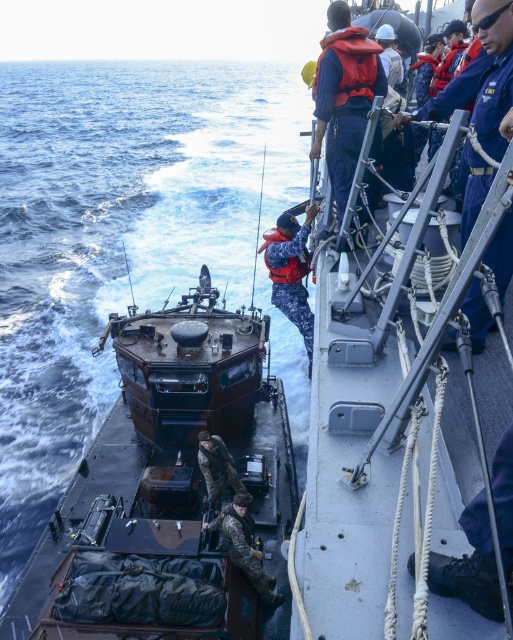
Is brown matte boat at center closer to camera compared to red nylon life jacket at upper right?

That is True.

Is brown matte boat at center further to the viewer compared to red nylon life jacket at upper right?

No, it is not.

At what (x,y) coordinates should I click in order to perform the action: click on brown matte boat at center. Please return your answer as a coordinate pair (x, y). Looking at the image, I should click on (170, 492).

Which is below, camouflage fabric uniform at center or camouflage fabric soldier at center?

camouflage fabric uniform at center is below.

Between point (238, 541) and point (200, 454), which one is positioned in front?

Point (238, 541) is more forward.

I want to click on camouflage fabric uniform at center, so click(x=244, y=545).

You are a GUI agent. You are given a task and a screenshot of the screen. Output one action in this format:
    pyautogui.click(x=<x>, y=<y>)
    Task: Click on the camouflage fabric uniform at center
    This screenshot has width=513, height=640.
    Given the screenshot: What is the action you would take?
    pyautogui.click(x=244, y=545)

Who is positioned more to the left, red nylon life jacket at center or red nylon life jacket at upper right?

red nylon life jacket at center

Can you confirm if red nylon life jacket at center is shorter than red nylon life jacket at upper right?

Yes.

Which is in front, point (287, 273) or point (462, 49)?

Point (287, 273)

Identify the location of red nylon life jacket at center. (287, 260).